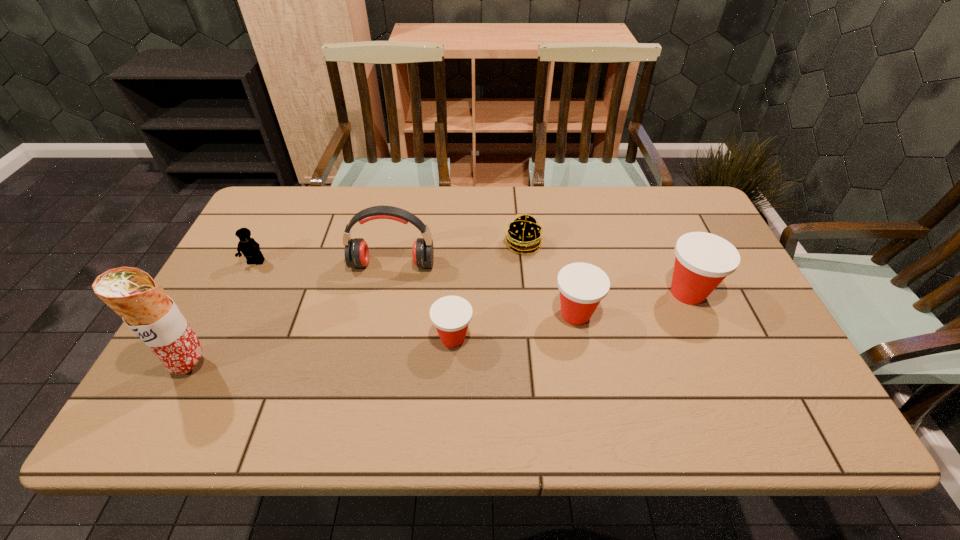
Locate an element on the screen. This screenshot has width=960, height=540. the shortest Dixie cup is located at coordinates (451, 315).

Image resolution: width=960 pixels, height=540 pixels. In order to click on the fourth object from left to right in this screenshot , I will do `click(451, 315)`.

I want to click on the second tallest Dixie cup, so click(x=582, y=286).

Locate an element on the screen. the rightmost object is located at coordinates (703, 260).

Where is `the tallest Dixie cup`? This screenshot has width=960, height=540. the tallest Dixie cup is located at coordinates (703, 260).

Where is `Lego`? Lego is located at coordinates (248, 246).

Find the location of a particular element. This screenshot has height=540, width=960. patty is located at coordinates (523, 235).

Find the location of a particular element. The height and width of the screenshot is (540, 960). earphone is located at coordinates (356, 252).

You are a GUI agent. You are given a task and a screenshot of the screen. Output one action in this format:
    pyautogui.click(x=<x>, y=<y>)
    Task: Click on the third object from left to right
    This screenshot has height=540, width=960.
    Given the screenshot: What is the action you would take?
    pyautogui.click(x=356, y=252)

Find the location of a particular element. Image resolution: width=960 pixels, height=540 pixels. the tallest object is located at coordinates (132, 293).